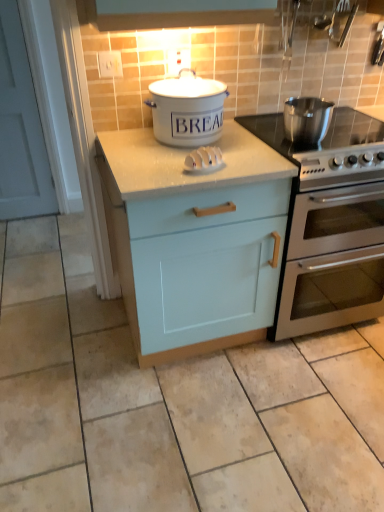
Find the location of a particular element. This screenshot has height=512, width=384. free location above light blue wood cabinet at center (from a real-world perspective) is located at coordinates (174, 155).